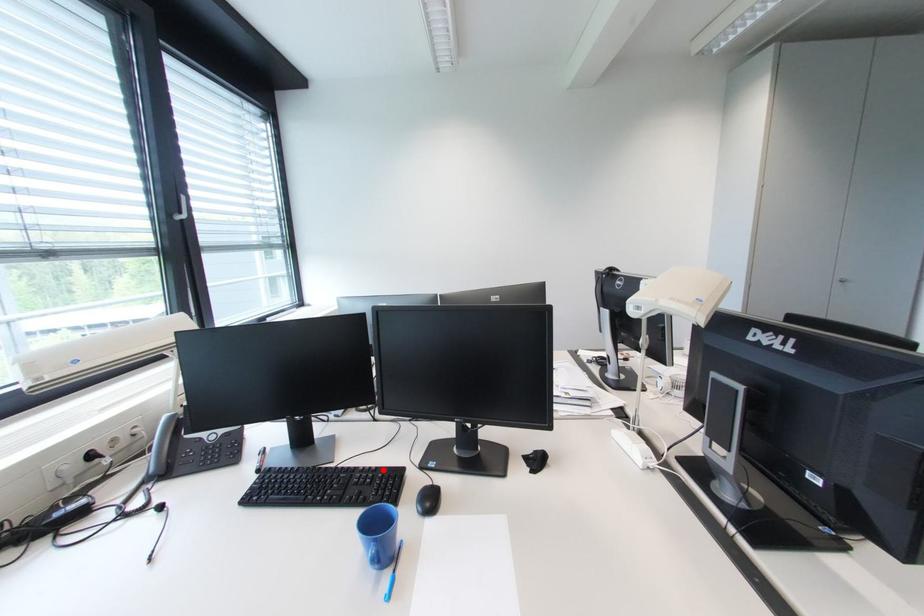
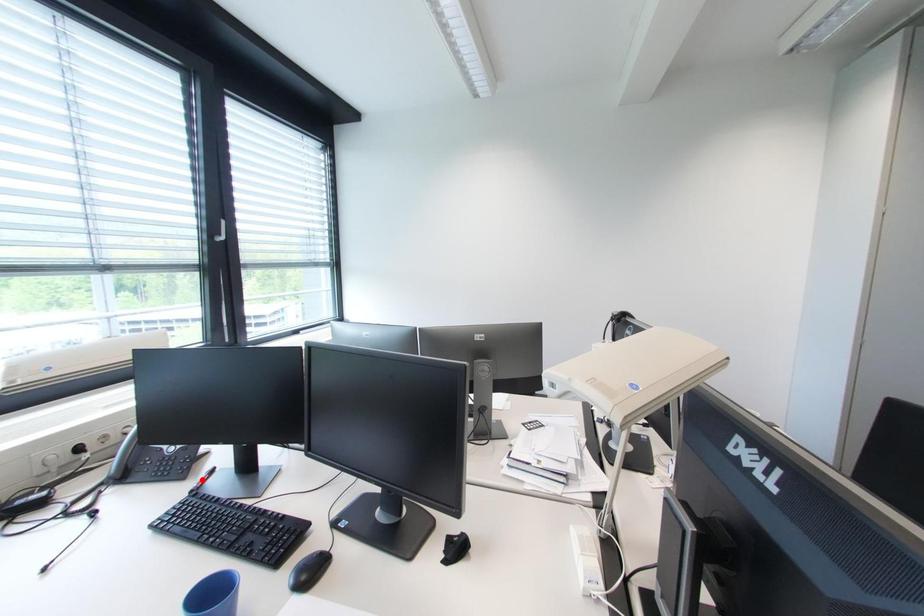
I am providing you with two images of the same scene from different viewpoints. A red point is marked on the first image and another point is marked on the second image. Are the points marked in image1 and image2 representing the same 3D position?

No